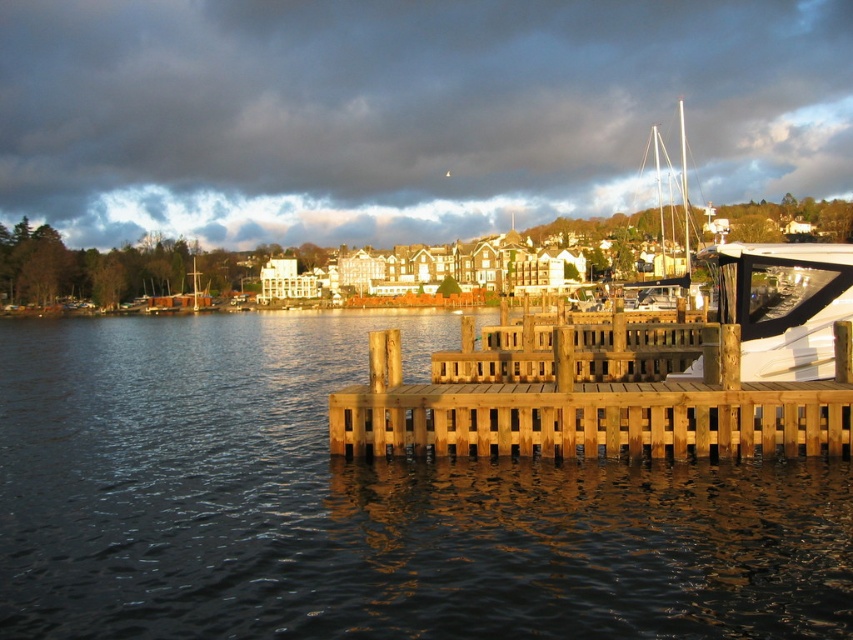
Question: Which point is closer to the camera?

Choices:
 (A) wooden dock at lower center
 (B) white matte boat at center

Answer: (A)

Question: Is brown wooden dock at lower center in front of white matte boat at center?

Choices:
 (A) yes
 (B) no

Answer: (A)

Question: Does brown wooden dock at lower center have a larger size compared to wooden dock at lower center?

Choices:
 (A) no
 (B) yes

Answer: (B)

Question: Estimate the real-world distances between objects in this image. Which object is farther from the brown wooden dock at lower center?

Choices:
 (A) white matte boat at center
 (B) wooden dock at lower center

Answer: (A)

Question: Can you confirm if wooden dock at lower center is positioned below white matte boat at center?

Choices:
 (A) yes
 (B) no

Answer: (A)

Question: Considering the real-world distances, which object is closest to the brown wooden dock at lower center?

Choices:
 (A) white matte boat at center
 (B) wooden dock at lower center

Answer: (B)